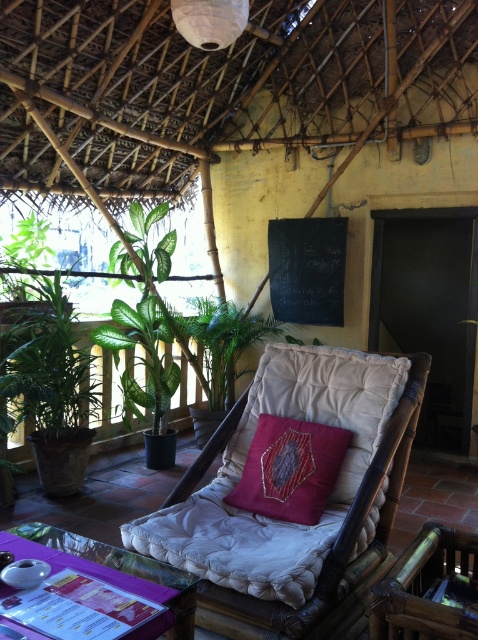
Can you confirm if green leafy plant at left is shorter than transparent glass table at lower center?

In fact, green leafy plant at left may be taller than transparent glass table at lower center.

Between point (64, 294) and point (178, 636), which one is positioned in front?

Point (178, 636)

Between point (65, 404) and point (143, 577), which one is positioned behind?

The point (65, 404) is behind.

Where is `green leafy plant at left`? green leafy plant at left is located at coordinates coord(47,365).

Is beige fabric rocking chair at center thinner than green leafy plant at left?

No, beige fabric rocking chair at center is not thinner than green leafy plant at left.

Does point (221, 502) come farther from viewer compared to point (75, 408)?

No, (221, 502) is closer to viewer.

Where is `beige fabric rocking chair at center`? beige fabric rocking chair at center is located at coordinates (289, 522).

The width and height of the screenshot is (478, 640). What do you see at coordinates (290, 468) in the screenshot? I see `embroidered velvet cushion at center` at bounding box center [290, 468].

Is embroidered velvet cushion at center bigger than transparent glass table at lower center?

Correct, embroidered velvet cushion at center is larger in size than transparent glass table at lower center.

Image resolution: width=478 pixels, height=640 pixels. Describe the element at coordinates (290, 468) in the screenshot. I see `embroidered velvet cushion at center` at that location.

Identify the location of embroidered velvet cushion at center. Image resolution: width=478 pixels, height=640 pixels. (290, 468).